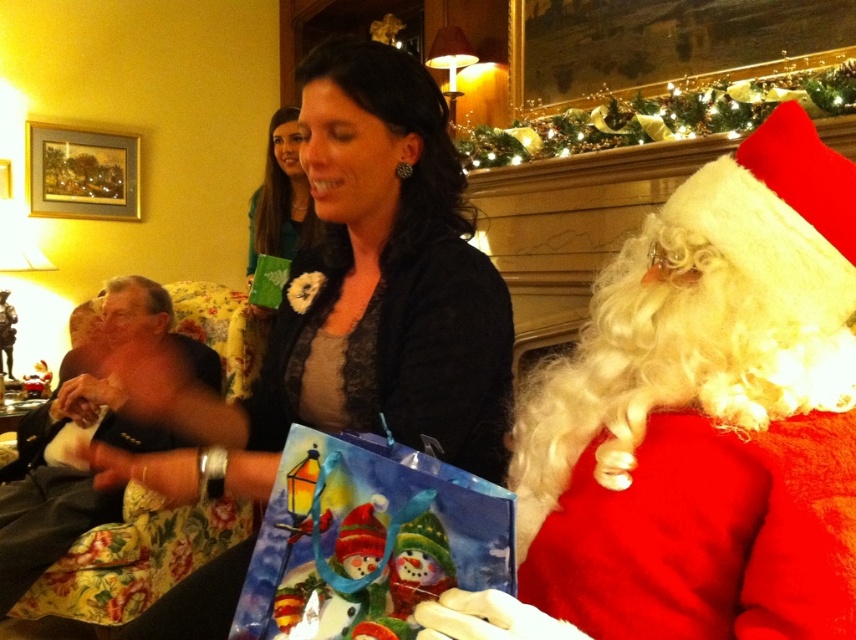
Is point (199, 444) positioned behind point (85, 481)?

No.

Is matte black sweater at center further to camera compared to dark gray fabric suit at left?

No, it is not.

Is point (308, 372) positioned after point (93, 417)?

No, (308, 372) is in front of (93, 417).

Where is `matte black sweater at center`? matte black sweater at center is located at coordinates (349, 301).

Describe the element at coordinates (697, 420) in the screenshot. Image resolution: width=856 pixels, height=640 pixels. I see `red fluffy santa at right` at that location.

Which is more to the right, red fluffy santa at right or watercolor paper bag at center?

From the viewer's perspective, red fluffy santa at right appears more on the right side.

Between point (849, 611) and point (317, 452), which one is positioned behind?

Point (317, 452)

Where is `red fluffy santa at right`? This screenshot has height=640, width=856. red fluffy santa at right is located at coordinates (697, 420).

Is red fluffy santa at right to the right of matte black sweater at center from the viewer's perspective?

Yes, red fluffy santa at right is to the right of matte black sweater at center.

Who is taller, red fluffy santa at right or matte black sweater at center?

With more height is matte black sweater at center.

Is point (633, 310) closer to camera compared to point (431, 403)?

Yes.

The width and height of the screenshot is (856, 640). Find the location of `red fluffy santa at right`. red fluffy santa at right is located at coordinates (697, 420).